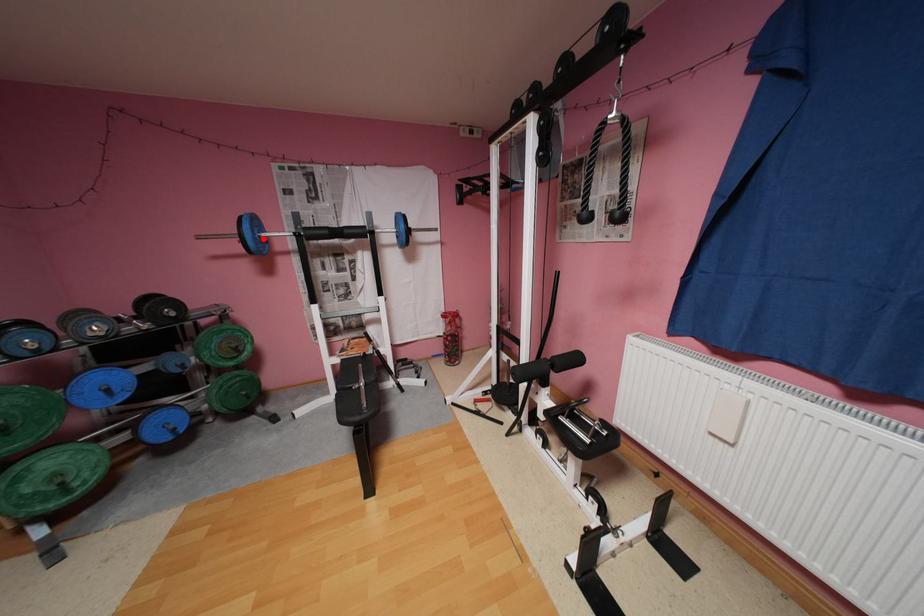
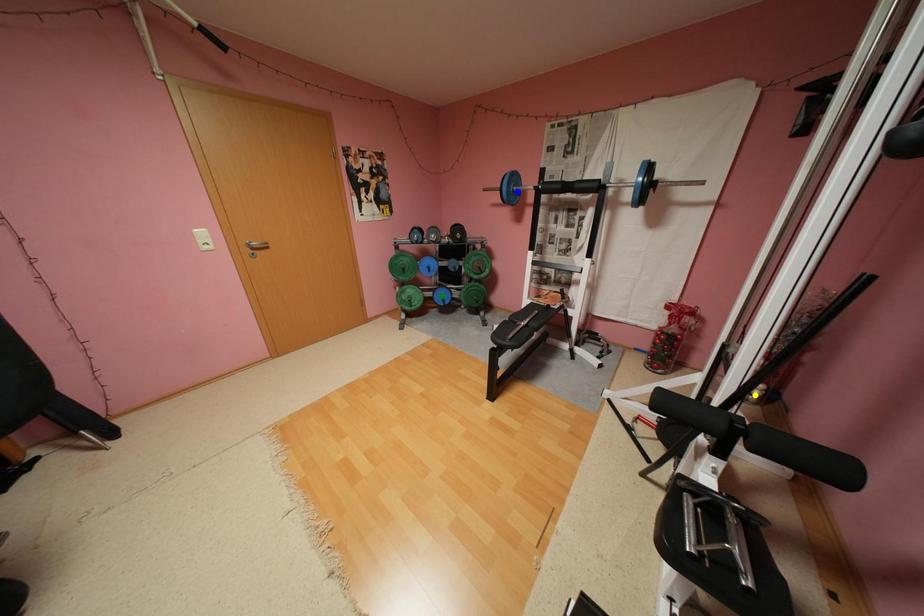
Question: I am providing you with two images of the same scene from different viewpoints. A red point is marked on the first image. You are given multiple points on the second image. Which spot in image 2 lines up with the point in image 1?

Choices:
 (A) green point
 (B) yellow point
 (C) blue point

Answer: (C)